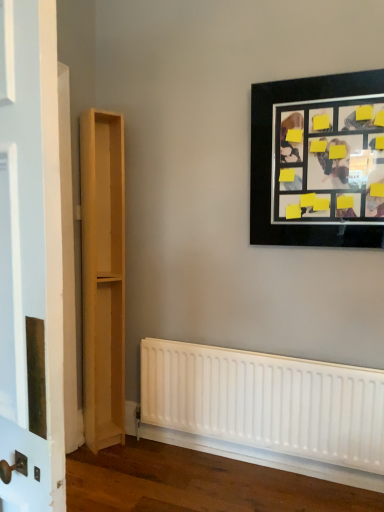
The height and width of the screenshot is (512, 384). Identify the location of blank space above white matte radiator at lower center (from a real-world perspective). (259, 355).